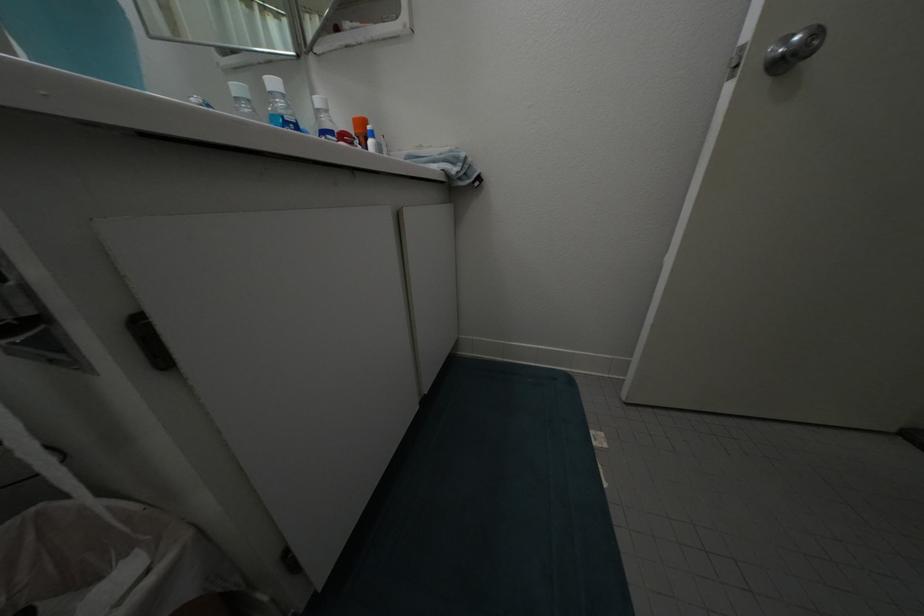
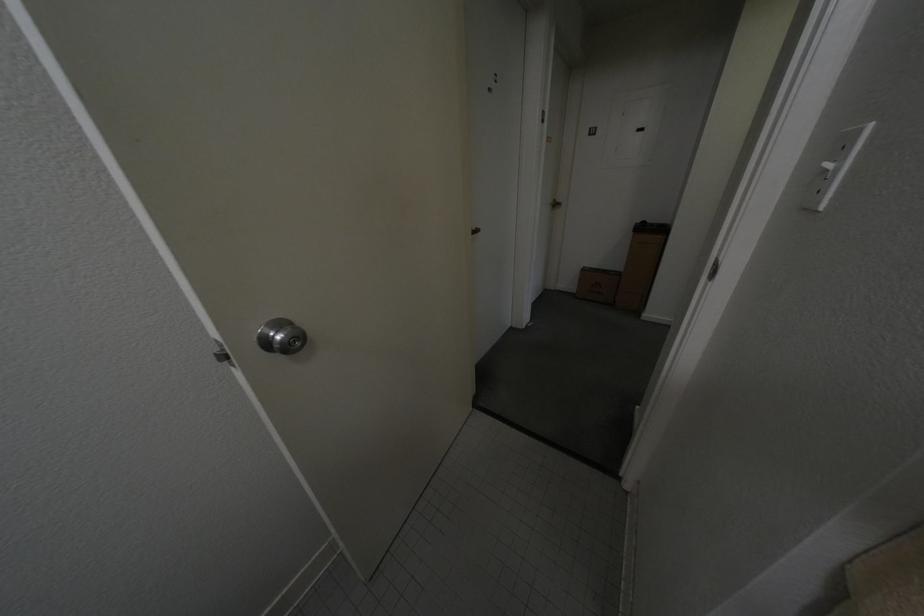
From the picture: The first image is from the beginning of the video and the second image is from the end. How did the camera likely rotate when shooting the video?

The rotation direction of the camera is right-down.